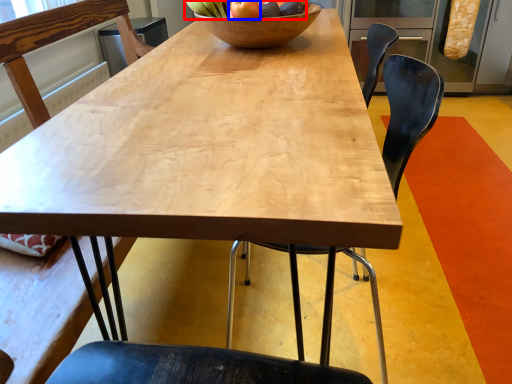
Question: Which object is further to the camera taking this photo, fruit (highlighted by a red box) or apple (highlighted by a blue box)?

Choices:
 (A) fruit
 (B) apple

Answer: (A)